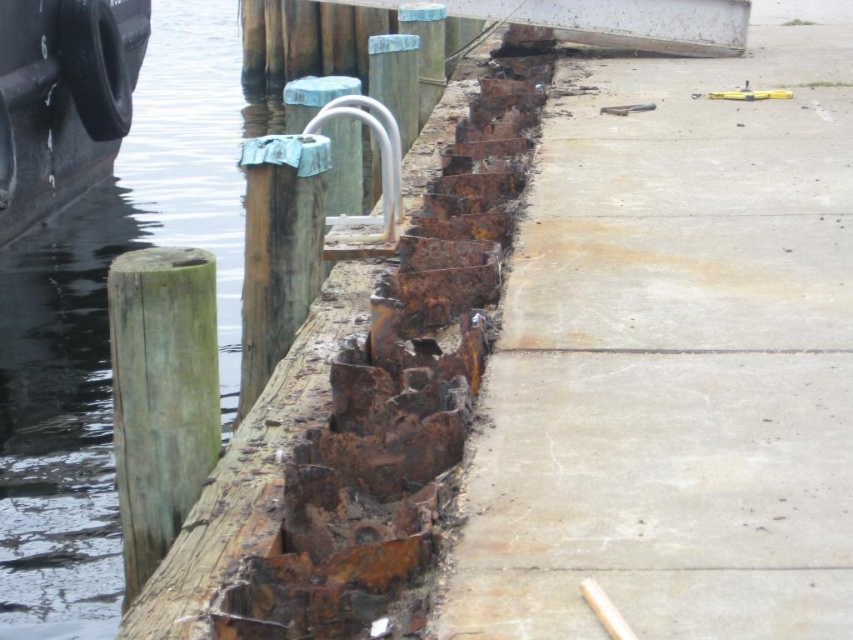
Question: Estimate the real-world distances between objects in this image. Which object is closer to the rusty wood pole at center?

Choices:
 (A) green wood post at left
 (B) rusty metal water at left
 (C) concrete at right
 (D) rusty wood post at center

Answer: (A)

Question: Is the position of green wood post at left more distant than that of rusty wood pole at center?

Choices:
 (A) no
 (B) yes

Answer: (A)

Question: Which object is the closest to the green wood post at left?

Choices:
 (A) rusty wood pole at center
 (B) concrete at right
 (C) rusty metal water at left

Answer: (A)

Question: Is black rubber tire at left to the left of rusty wood pole at center from the viewer's perspective?

Choices:
 (A) no
 (B) yes

Answer: (B)

Question: Does green wood post at left have a lesser width compared to black rubber tire at left?

Choices:
 (A) no
 (B) yes

Answer: (B)

Question: Which of these objects is positioned closest to the black rubber tire at left?

Choices:
 (A) concrete at right
 (B) green wood post at left
 (C) rusty wood post at center

Answer: (C)